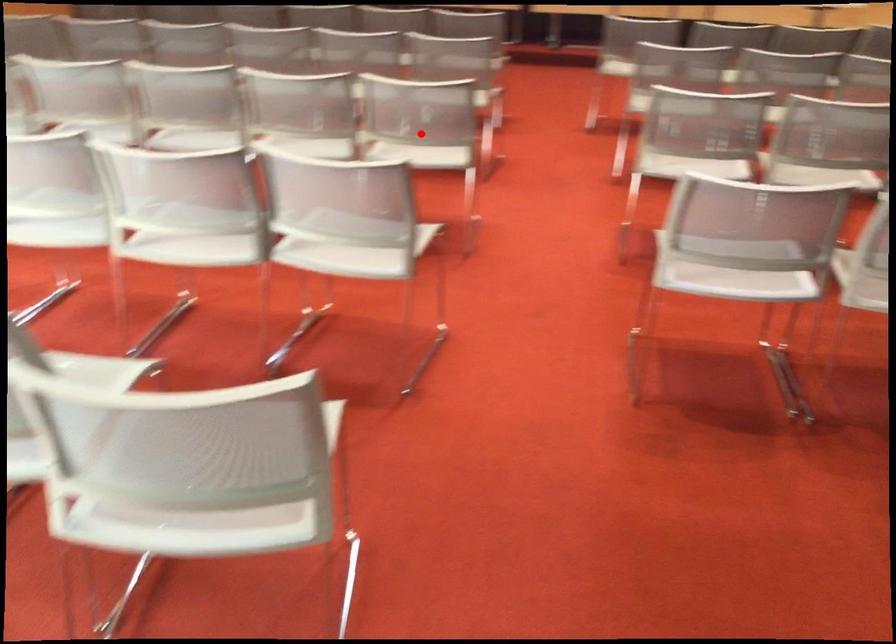
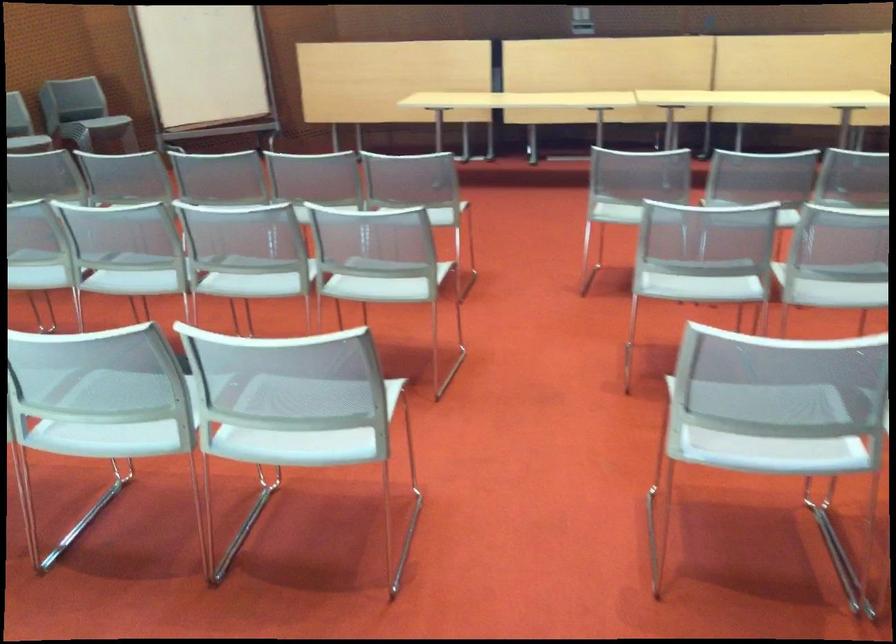
Where in the second image is the point corresponding to the highlighted location from the first image?

(300, 415)